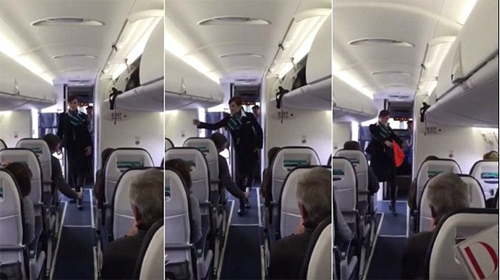
In order to click on wall in this screenshot , I will do `click(454, 148)`, `click(343, 130)`, `click(286, 136)`, `click(187, 124)`, `click(20, 128)`, `click(120, 129)`.